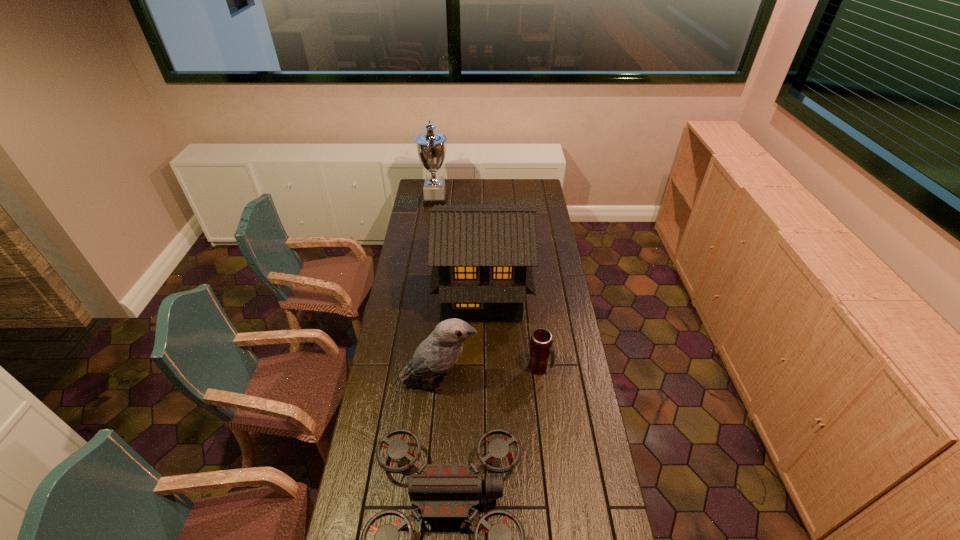
Locate an element on the screen. This screenshot has height=540, width=960. the fourth closest object to the dollhouse is located at coordinates (442, 491).

Where is `vacant space that satisfies the following two spatial constraints: 1. on the front-facing side of the dollhouse; 2. on the front-facing side of the third shortest object`? Image resolution: width=960 pixels, height=540 pixels. vacant space that satisfies the following two spatial constraints: 1. on the front-facing side of the dollhouse; 2. on the front-facing side of the third shortest object is located at coordinates (483, 382).